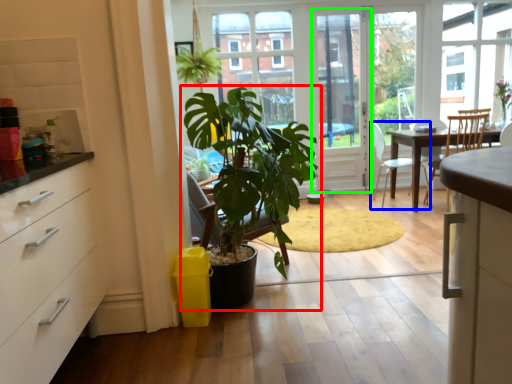
Question: Considering the real-world distances, which object is closest to houseplant (highlighted by a red box)? chair (highlighted by a blue box) or screen door (highlighted by a green box).

Choices:
 (A) chair
 (B) screen door

Answer: (B)